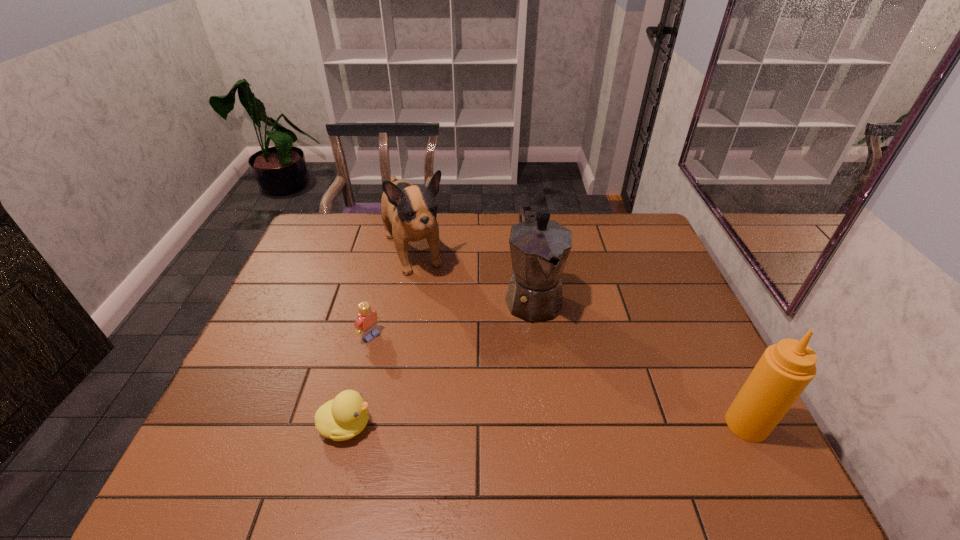
Locate an element on the screen. vacant spot on the desktop that is between the shortest object and the condiment and is positioned on the front-facing side of the Lego is located at coordinates pyautogui.click(x=503, y=425).

In order to click on free space on the desktop that is between the duckling and the rightmost object and is positioned at the face of the puppy in this screenshot , I will do `click(502, 425)`.

At what (x,y) coordinates should I click in order to perform the action: click on free spot on the desktop that is between the shortest object and the rightmost object and is positioned on the pouring side of the fourth object from left to right. Please return your answer as a coordinate pair (x, y). This screenshot has height=540, width=960. Looking at the image, I should click on coord(591,424).